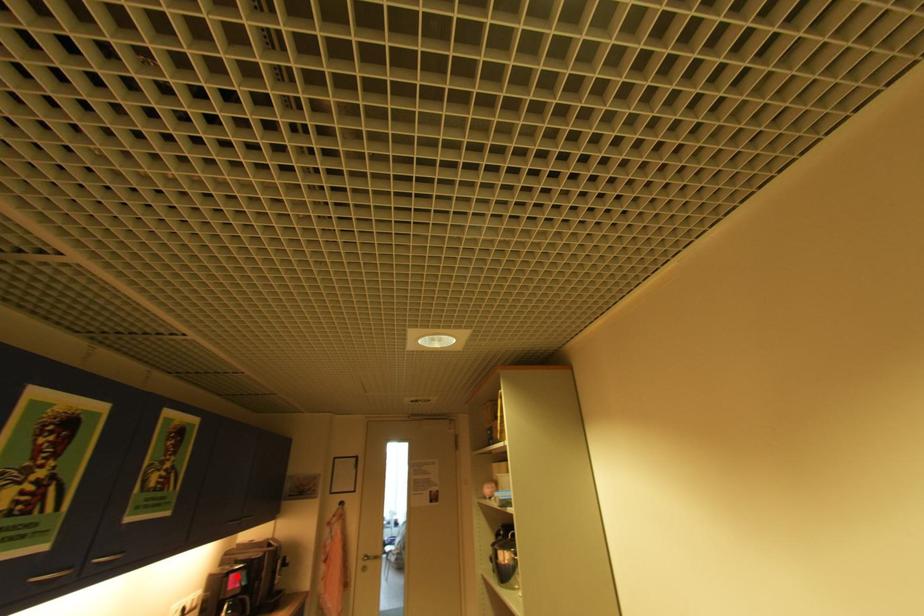
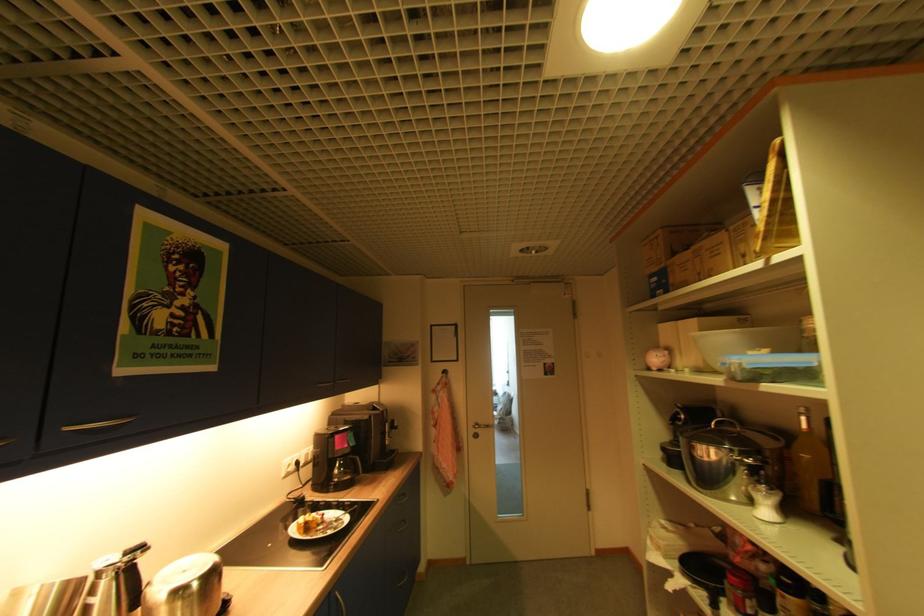
Question: I am providing you with two images of the same scene from different viewpoints. Image1 has a red point marked. In image2, the corresponding 3D location appears at what relative position? Reply with the corresponding letter.

Choices:
 (A) Closer
 (B) Farther

Answer: (B)